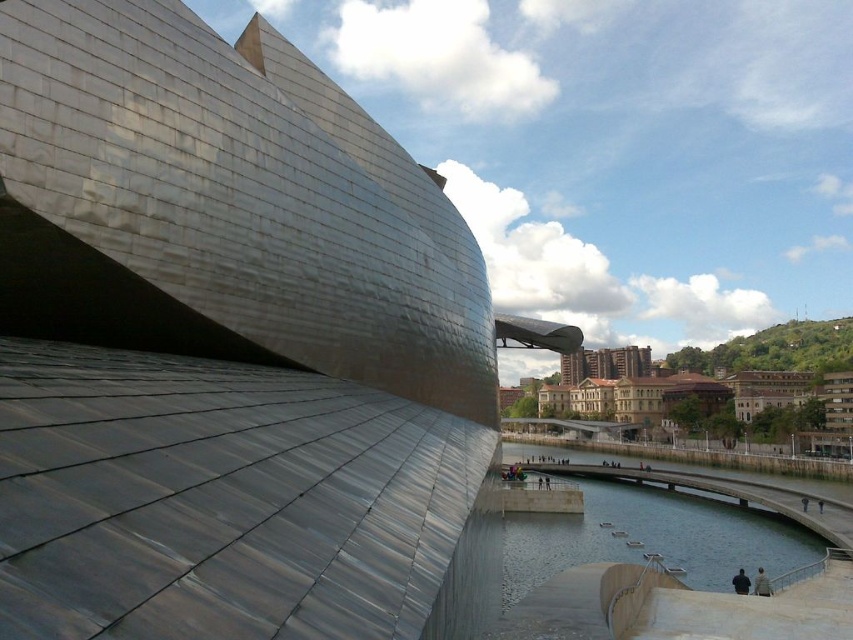
You are standing at the camera position looking at the architectural structure. There is a point marked at coordinates point (585, 556). Can you reach that point by walking straight ahead without deviating from your path?

The point (585, 556) is 45.90 meters away from the camera, so yes, you can walk straight ahead to reach it as there is a clear path along the concrete walkway described in the scene.

In the scene shown: Based on the scene, which object occupies a larger area in the image? Please choose between the metallic silver building at upper left and the clear water at lower center.

The clear water at lower center occupies a larger area in the image compared to the metallic silver building at upper left, as stated in the description that the metallic silver building at upper left has a smaller size compared to clear water at lower center.